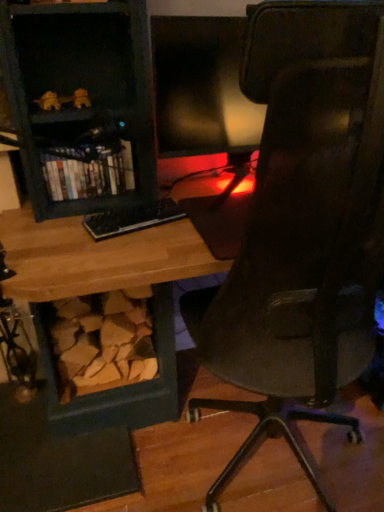
Find the location of a particular element. The width and height of the screenshot is (384, 512). free space to the left of black plastic keyboard at center is located at coordinates (57, 233).